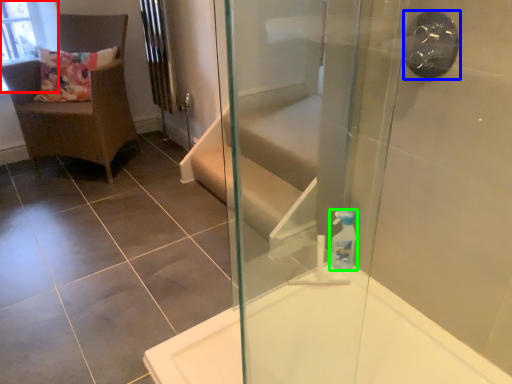
Question: Based on their relative distances, which object is farther from window screen (highlighted by a red box)? Choose from shower (highlighted by a blue box) and soap dispenser (highlighted by a green box).

Choices:
 (A) shower
 (B) soap dispenser

Answer: (A)